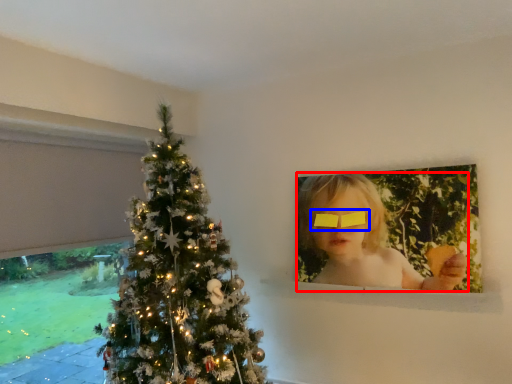
Question: Which point is closer to the camera, girl (highlighted by a red box) or glasses (highlighted by a blue box)?

Choices:
 (A) girl
 (B) glasses

Answer: (A)